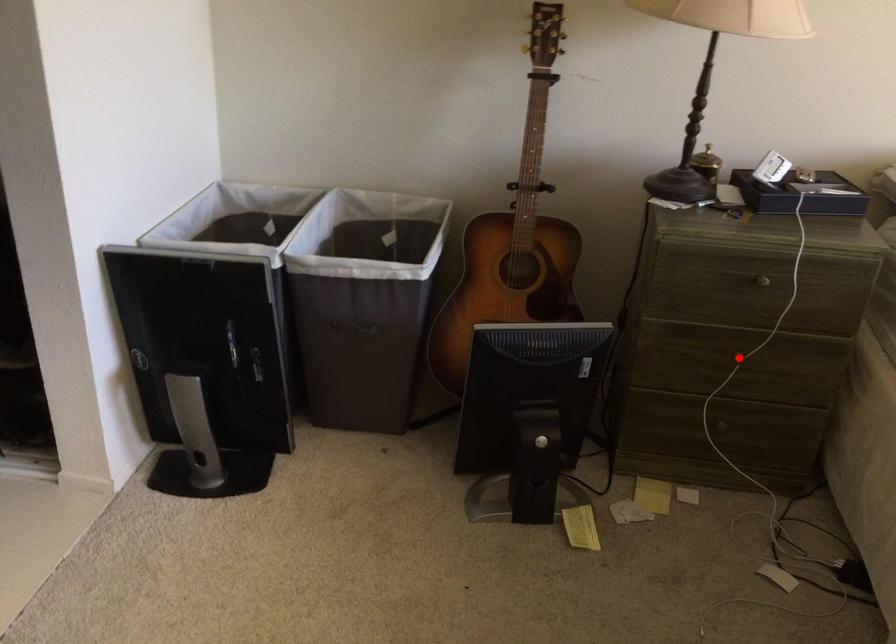
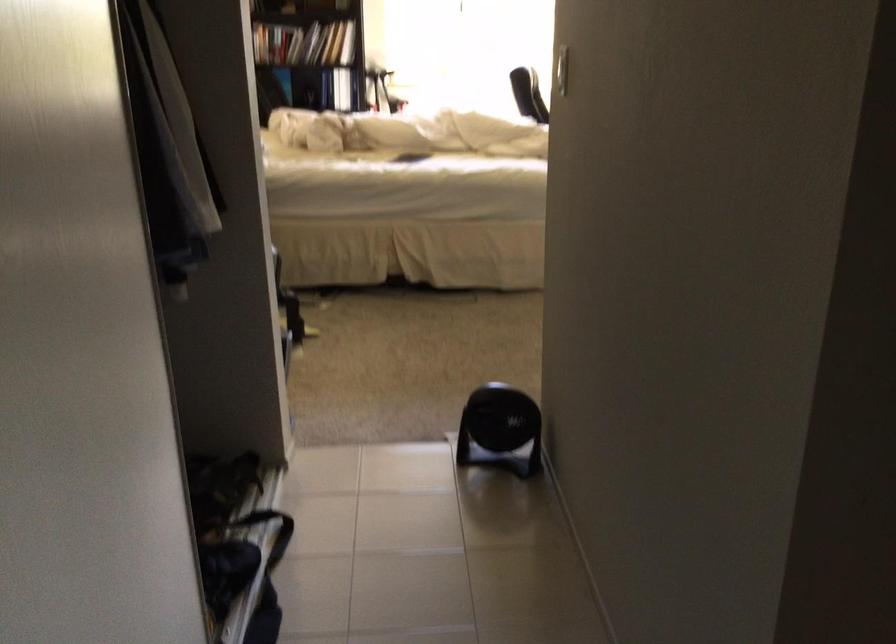
Question: I am providing you with two images of the same scene from different viewpoints. A red point is marked on the first image. Can you still see the location of the red point in image 2?

Choices:
 (A) Yes
 (B) No

Answer: (B)